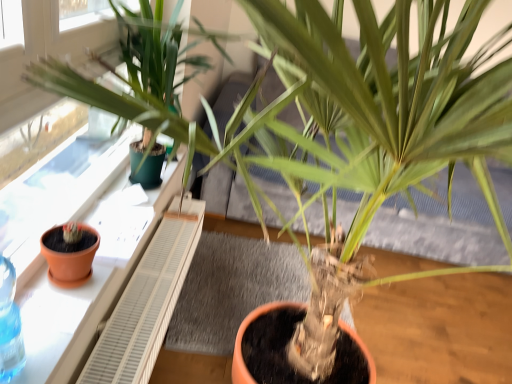
Question: Based on their sizes in the image, would you say terracotta clay pot at left is bigger or smaller than terracotta clay pot at left?

Choices:
 (A) big
 (B) small

Answer: (A)

Question: From the image's perspective, is terracotta clay pot at left located above or below terracotta clay pot at left?

Choices:
 (A) above
 (B) below

Answer: (A)

Question: In terms of width, does terracotta clay pot at left look wider or thinner when compared to terracotta clay pot at left?

Choices:
 (A) thin
 (B) wide

Answer: (B)

Question: Does point (52, 248) appear closer or farther from the camera than point (123, 261)?

Choices:
 (A) closer
 (B) farther

Answer: (A)

Question: Is terracotta clay pot at left taller or shorter than terracotta clay pot at left?

Choices:
 (A) short
 (B) tall

Answer: (B)

Question: Is terracotta clay pot at left wider or thinner than terracotta clay pot at left?

Choices:
 (A) wide
 (B) thin

Answer: (B)

Question: Relative to terracotta clay pot at left, is terracotta clay pot at left in front or behind?

Choices:
 (A) front
 (B) behind

Answer: (B)